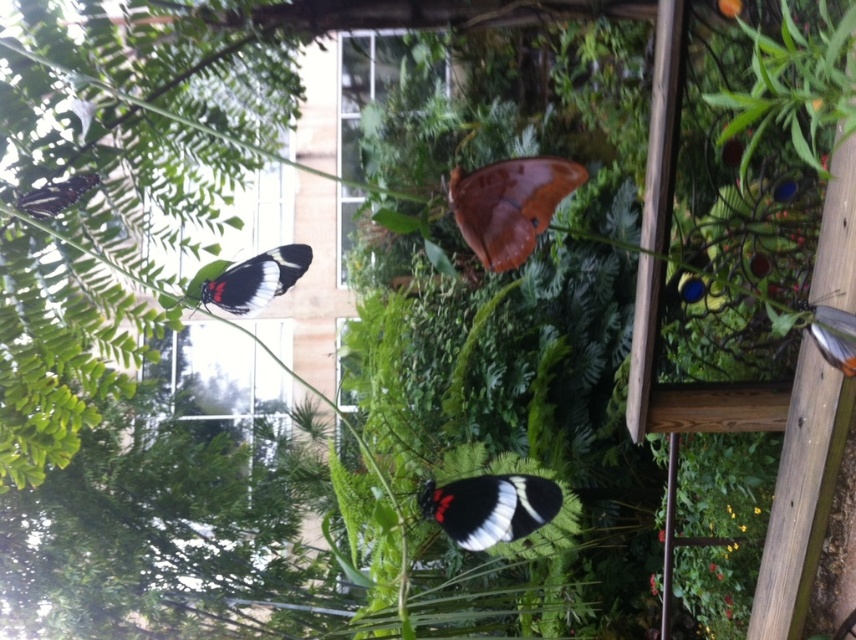
You are a gardener who wants to place a small decorative statue between the black and white winged insect at center and the black matte butterfly at upper left. The statue is 18 inches tall. Will the statue fit vertically between them?

The distance between the black and white winged insect at center and the black matte butterfly at upper left is 17.84 inches. Since the statue is 18 inches tall, it will not fit vertically between them as it is slightly taller than the available space.

You are a nature photographer aiming to capture both the black and white winged insect at center and the translucent white butterfly at upper right in a single frame. Based on their positions, which butterfly should you adjust your camera focus on first to ensure both are in the same focal plane?

The black and white winged insect at center is to the left of the translucent white butterfly at upper right, so you should focus on the translucent white butterfly at upper right first since it is farther away. This ensures both will be in focus when using depth of field techniques.

You are a nature photographer aiming to capture both the black and white winged insect at center and the translucent white butterfly at upper right in a single frame. Considering their sizes, which butterfly should you focus on first to ensure they both fit in the shot?

The black and white winged insect at center is larger than the translucent white butterfly at upper right, so you should focus on the black and white winged insect at center first to ensure it fits properly in the frame, allowing space for the smaller butterfly as well.